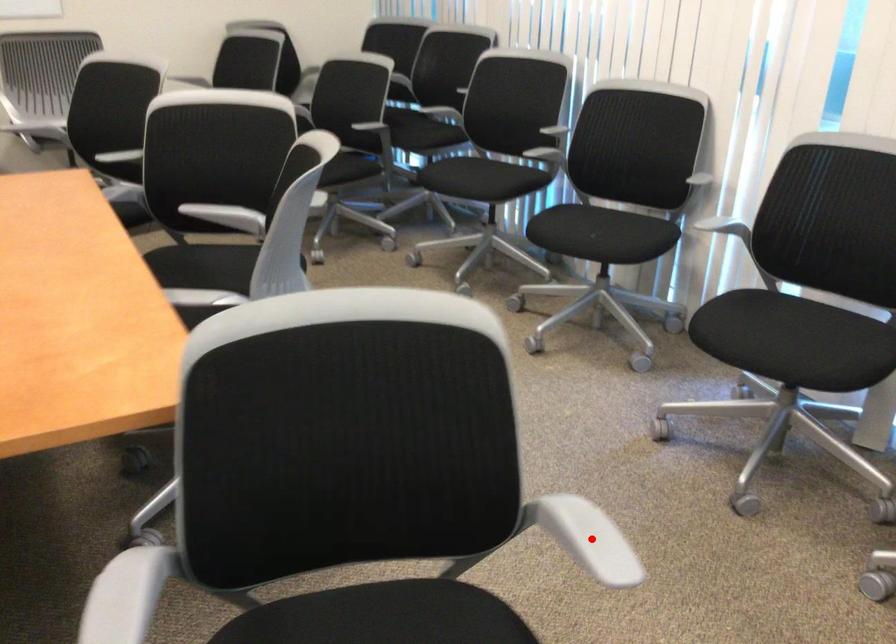
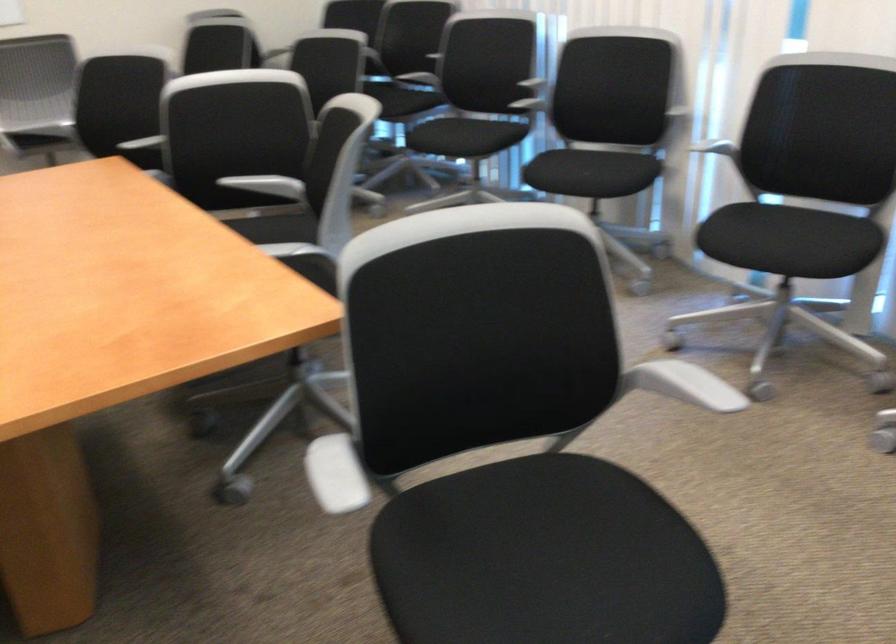
The point at the highlighted location is marked in the first image. Where is the corresponding point in the second image?

(682, 384)